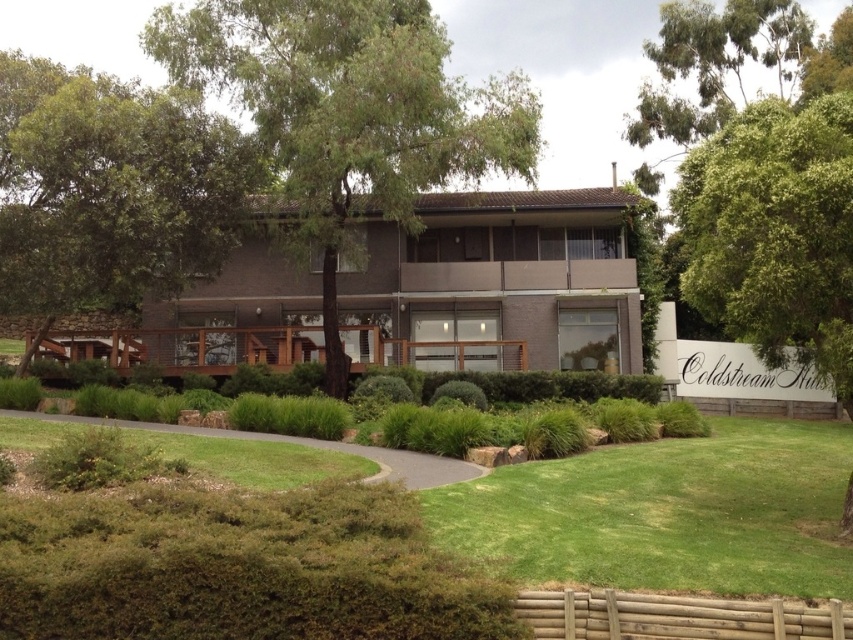
Does green leafy tree at center lie behind green grass at lower center?

Yes.

Can you confirm if green leafy tree at center is positioned below green grass at lower center?

No.

Is point (399, 108) closer to viewer compared to point (497, 547)?

No, (399, 108) is further to viewer.

At what (x,y) coordinates should I click in order to perform the action: click on green leafy tree at center. Please return your answer as a coordinate pair (x, y). This screenshot has height=640, width=853. Looking at the image, I should click on (349, 109).

Which is more to the left, green leafy tree at upper left or green grass at lower left?

→ green leafy tree at upper left is more to the left.

Who is more distant from viewer, (149,204) or (285,474)?

The point (149,204) is behind.

Is point (236, 208) positioned behind point (207, 460)?

Yes, point (236, 208) is behind point (207, 460).

Image resolution: width=853 pixels, height=640 pixels. I want to click on green leafy tree at upper left, so click(109, 192).

Describe the element at coordinates (349, 109) in the screenshot. I see `green leafy tree at center` at that location.

This screenshot has width=853, height=640. Identify the location of green leafy tree at center. (349, 109).

Between point (289, 196) and point (252, 172), which one is positioned behind?

Point (252, 172)

Locate an element on the screen. green leafy tree at center is located at coordinates (349, 109).